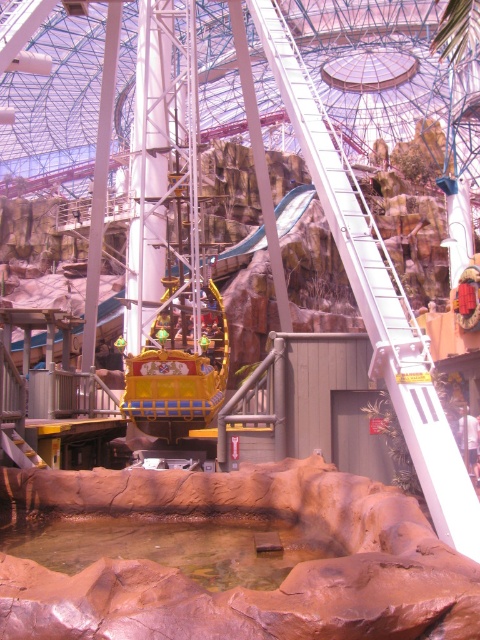
You are a visitor at the amusement park and want to take a photo of the shiny gold boat at center. To get the best shot, you need to know where the smooth stone water at lower center is in relation to the boat. Can you tell me if the water is above or below the boat?

The smooth stone water at lower center is located below the shiny gold boat at center, so the water is below the boat.